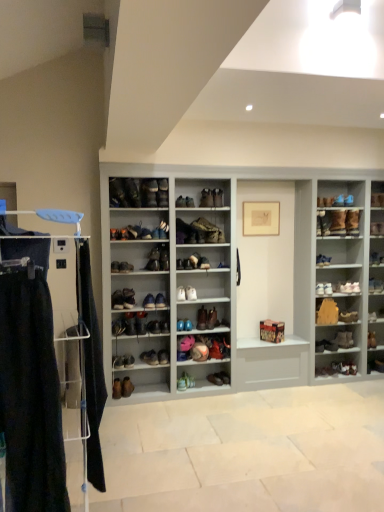
You are a GUI agent. You are given a task and a screenshot of the screen. Output one action in this format:
    pyautogui.click(x=<x>, y=<y>)
    Task: Click on the vacant area in front of matte brown shoe at center, the 10th shoe from the left
    The image size is (384, 512).
    Given the screenshot: What is the action you would take?
    pyautogui.click(x=183, y=395)